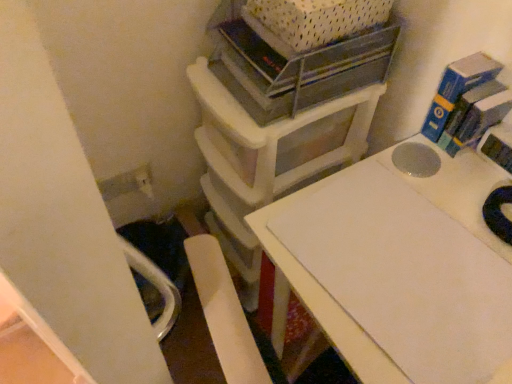
Question: Does white plastic storage unit at upper center have a lesser width compared to white matte table at center?

Choices:
 (A) yes
 (B) no

Answer: (A)

Question: Does white plastic storage unit at upper center lie in front of white matte table at center?

Choices:
 (A) yes
 (B) no

Answer: (B)

Question: Is white plastic storage unit at upper center not within white matte table at center?

Choices:
 (A) yes
 (B) no

Answer: (A)

Question: Is white plastic storage unit at upper center to the right of white matte table at center from the viewer's perspective?

Choices:
 (A) no
 (B) yes

Answer: (A)

Question: Could you tell me if white plastic storage unit at upper center is turned towards white matte table at center?

Choices:
 (A) yes
 (B) no

Answer: (B)

Question: Is point (351, 64) closer or farther from the camera than point (388, 352)?

Choices:
 (A) closer
 (B) farther

Answer: (B)

Question: From a real-world perspective, is metallic gray shelf at upper center physically located above or below white matte table at center?

Choices:
 (A) above
 (B) below

Answer: (A)

Question: Relative to white matte table at center, is metallic gray shelf at upper center in front or behind?

Choices:
 (A) front
 (B) behind

Answer: (B)

Question: From their relative heights in the image, would you say metallic gray shelf at upper center is taller or shorter than white matte table at center?

Choices:
 (A) short
 (B) tall

Answer: (A)

Question: Visually, is metallic gray shelf at upper center positioned to the left or to the right of white plastic storage unit at upper center?

Choices:
 (A) right
 (B) left

Answer: (A)

Question: Is metallic gray shelf at upper center in front of or behind white plastic storage unit at upper center in the image?

Choices:
 (A) behind
 (B) front

Answer: (B)

Question: Do you think metallic gray shelf at upper center is within white plastic storage unit at upper center, or outside of it?

Choices:
 (A) outside
 (B) inside

Answer: (A)

Question: Is metallic gray shelf at upper center taller or shorter than white plastic storage unit at upper center?

Choices:
 (A) tall
 (B) short

Answer: (B)

Question: Based on their positions, is white plastic crate at upper center located to the left or right of white plastic storage unit at upper center?

Choices:
 (A) right
 (B) left

Answer: (A)

Question: Is white plastic crate at upper center taller or shorter than white plastic storage unit at upper center?

Choices:
 (A) short
 (B) tall

Answer: (A)